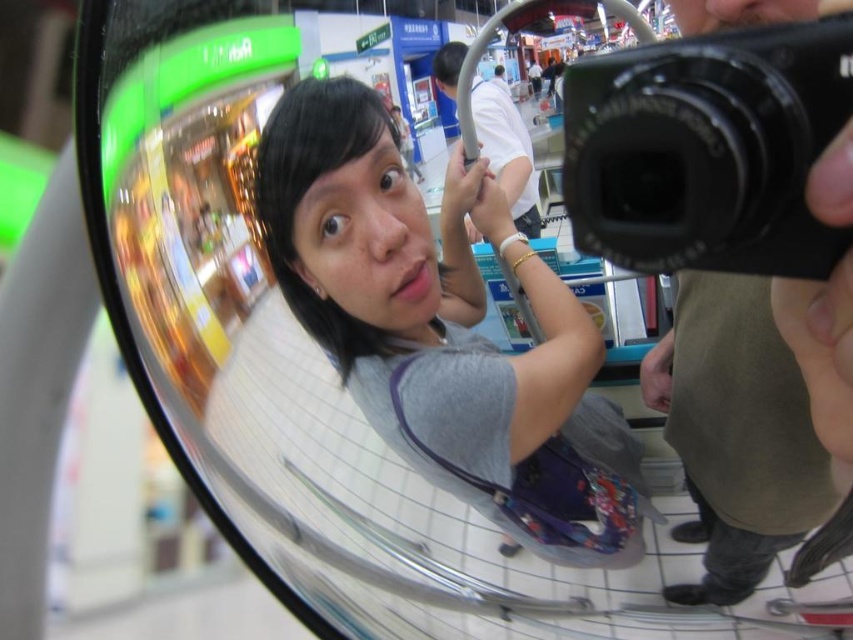
You are trying to determine which object in the image is bigger between the gray fabric shirt at center and the black plastic camera at upper right. Based on the reflection in the convex mirror, which one appears larger?

The gray fabric shirt at center appears larger than the black plastic camera at upper right in the convex mirror reflection.

You are a photographer trying to capture the reflection of the gray fabric shirt at center and the black plastic camera at upper right in the convex mirror. Given that the mirror can only clearly reflect objects within a 5 inch radius, will both objects be in focus?

The gray fabric shirt at center and black plastic camera at upper right are 4.83 inches apart from each other. Since the distance between them is less than 5 inches, both objects will be within the mirror s 5 inch radius and thus in focus.

You are a photographer trying to capture the reflection of the gray fabric shirt at center and the black plastic camera at upper right in the convex mirror. Based on the mirror distortion, which object will appear closer to the center of the mirror?

The gray fabric shirt at center appears closer to the center of the mirror because it is positioned below the black plastic camera at upper right, and convex mirrors distort objects so that those closer to the center appear less distorted and more centrally located.